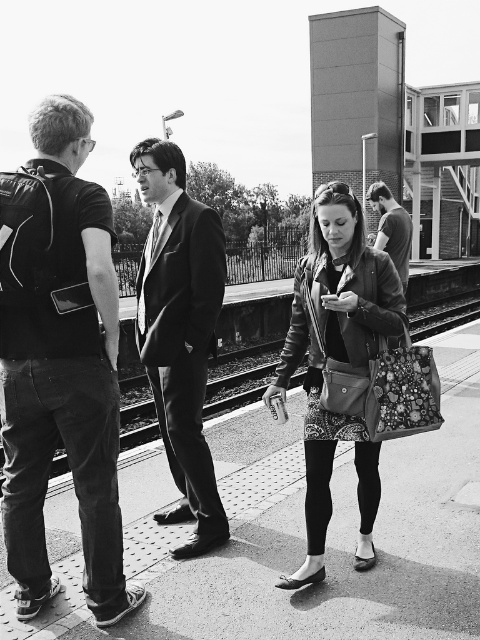
Based on the photo, which of these two, black fabric backpack at left or leather jacket at center, stands shorter?

leather jacket at center is shorter.

Is black fabric backpack at left wider than leather jacket at center?

In fact, black fabric backpack at left might be narrower than leather jacket at center.

I want to click on black fabric backpack at left, so click(66, 381).

Between point (289, 579) and point (214, 301), which one is positioned behind?

Positioned behind is point (214, 301).

Does point (346, 428) come closer to viewer compared to point (173, 326)?

Yes, point (346, 428) is in front of point (173, 326).

This screenshot has height=640, width=480. I want to click on leather jacket at center, so click(x=337, y=362).

Where is `leather jacket at center`? leather jacket at center is located at coordinates (337, 362).

Is point (86, 550) in front of point (395, 230)?

That is True.

Is black fabric backpack at left to the right of dark gray suit at right from the viewer's perspective?

In fact, black fabric backpack at left is to the left of dark gray suit at right.

The image size is (480, 640). Describe the element at coordinates (66, 381) in the screenshot. I see `black fabric backpack at left` at that location.

Image resolution: width=480 pixels, height=640 pixels. In order to click on black fabric backpack at left in this screenshot , I will do `click(66, 381)`.